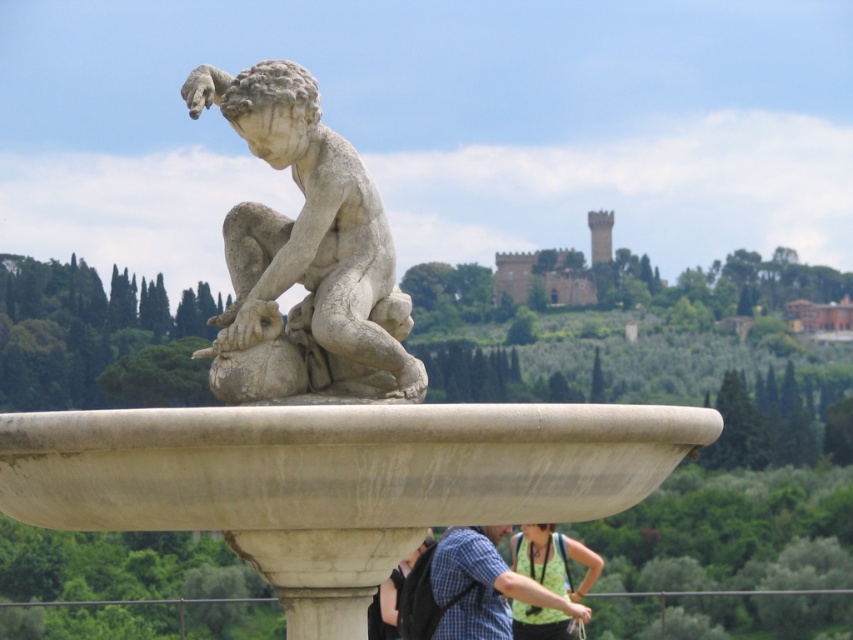
Consider the image. Does white marble statue at center appear under matte black shirt at lower center?

No, white marble statue at center is not below matte black shirt at lower center.

Which of these two, white marble statue at center or matte black shirt at lower center, stands taller?

Standing taller between the two is matte black shirt at lower center.

Is point (323, 232) more distant than point (386, 609)?

No, (323, 232) is in front of (386, 609).

The height and width of the screenshot is (640, 853). Identify the location of white marble statue at center. (305, 257).

Is point (373, 208) positioned before point (477, 602)?

Yes.

Can you confirm if white marble statue at center is taller than blue plaid shirt at center?

No.

Identify the location of white marble statue at center. (305, 257).

Measure the distance from white marble statue at center to green fabric top at lower center.

The distance of white marble statue at center from green fabric top at lower center is 68.52 meters.

Between point (276, 113) and point (579, 547), which one is positioned in front?

Point (276, 113)

The width and height of the screenshot is (853, 640). In order to click on white marble statue at center in this screenshot , I will do `click(305, 257)`.